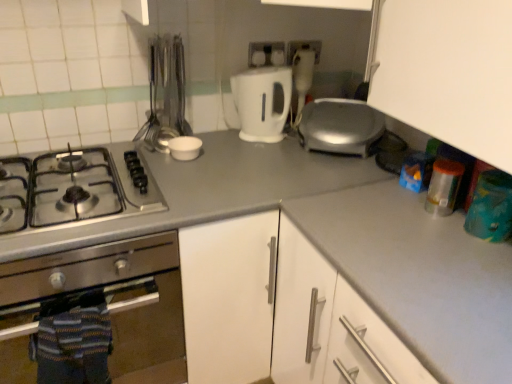
Identify the location of vacant area located to the right-hand side of metallic utensils at upper left. (221, 148).